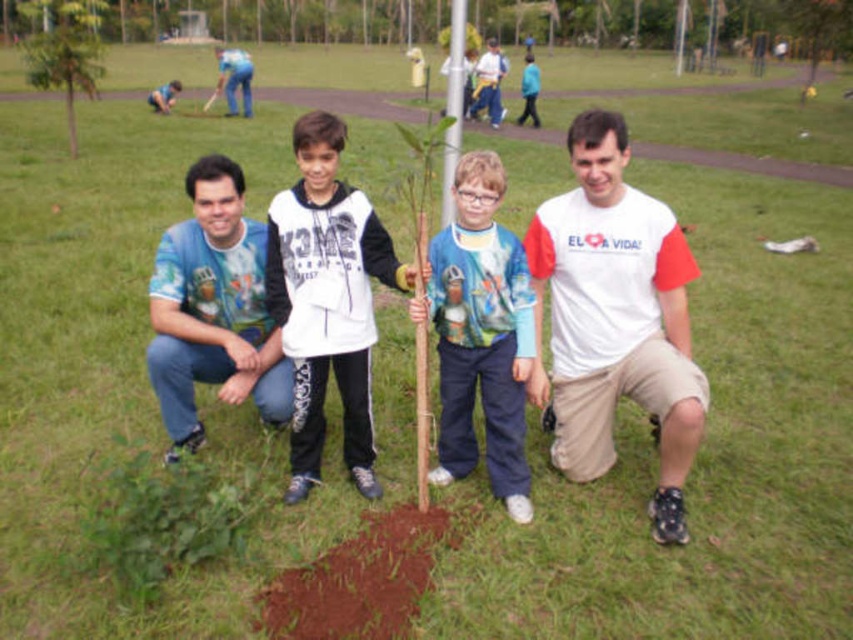
Question: Is white cotton t-shirt at center to the right of white matte shirt at center from the viewer's perspective?

Choices:
 (A) no
 (B) yes

Answer: (B)

Question: Can you confirm if white cotton t-shirt at center is wider than yellow fabric shirt at center?

Choices:
 (A) no
 (B) yes

Answer: (A)

Question: Is white cotton t-shirt at center smaller than yellow fabric shirt at center?

Choices:
 (A) yes
 (B) no

Answer: (A)

Question: Among these points, which one is nearest to the camera?

Choices:
 (A) (289, 336)
 (B) (189, 451)
 (C) (485, 397)

Answer: (A)

Question: Which of the following is the closest to the observer?

Choices:
 (A) (175, 304)
 (B) (454, 397)
 (C) (389, 244)

Answer: (C)

Question: Which is nearer to the blue jeans at upper left?

Choices:
 (A) white cotton t-shirt at center
 (B) blue printed t-shirt at left
 (C) white matte shirt at center
 (D) blue cotton shirt at center

Answer: (B)